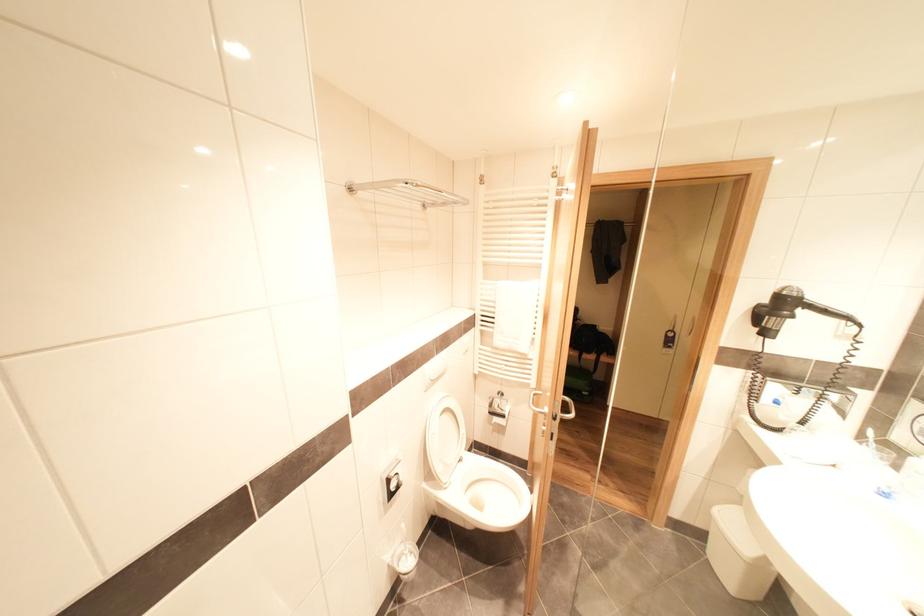
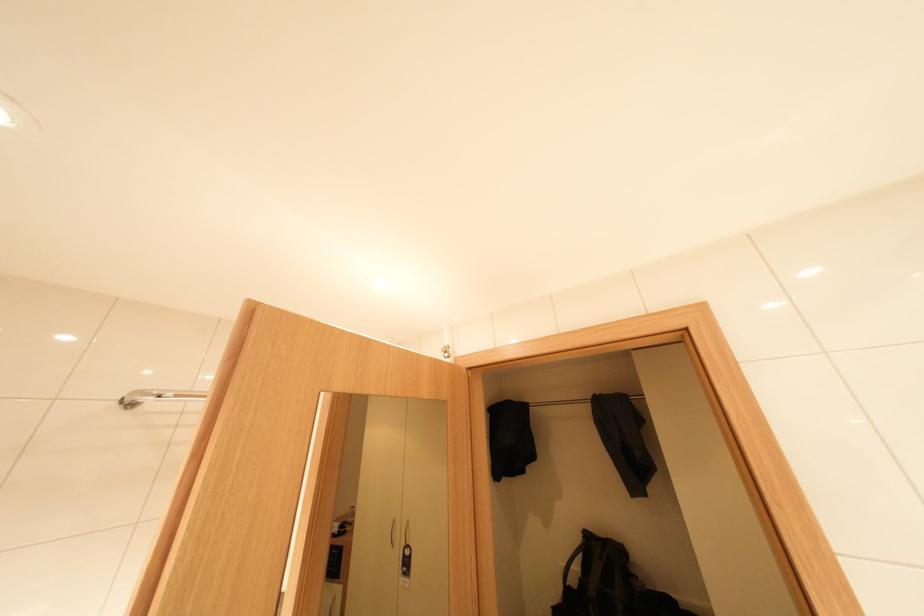
Locate, in the second image, the point that corresponds to [760,176] in the first image.

(697, 330)